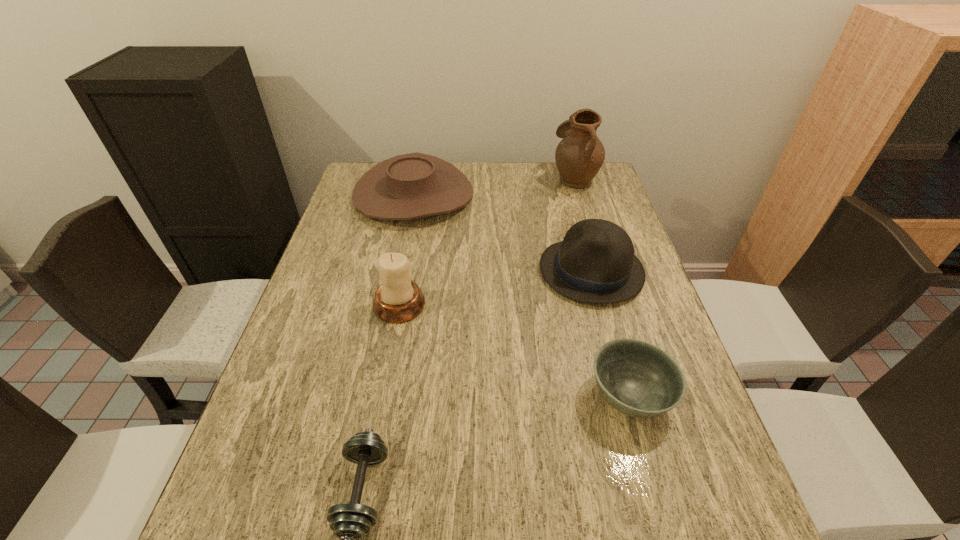
The width and height of the screenshot is (960, 540). Identify the location of object located at the far left corner. (409, 186).

You are a GUI agent. You are given a task and a screenshot of the screen. Output one action in this format:
    pyautogui.click(x=<x>, y=<y>)
    Task: Click on the object located at the far right corner
    
    Given the screenshot: What is the action you would take?
    pyautogui.click(x=579, y=156)

Where is `vacant space at the far edge of the desktop`? The height and width of the screenshot is (540, 960). vacant space at the far edge of the desktop is located at coordinates (507, 194).

The width and height of the screenshot is (960, 540). Identify the location of vacant region at the near edge. click(516, 530).

Where is `vacant space at the left edge of the desktop`? vacant space at the left edge of the desktop is located at coordinates (257, 413).

This screenshot has width=960, height=540. In the image, there is a desktop. In order to click on free space at the right edge in this screenshot , I will do `click(690, 407)`.

At what (x,y) coordinates should I click in order to perform the action: click on vacant space at the far left corner. Please return your answer as a coordinate pair (x, y). Looking at the image, I should click on (349, 195).

Where is `empty space between the bowler hat and the candle holder`? The image size is (960, 540). empty space between the bowler hat and the candle holder is located at coordinates (495, 287).

Locate an element on the screen. vacant area that lies between the fourth shortest object and the fifth farthest object is located at coordinates (611, 333).

Locate an element on the screen. The height and width of the screenshot is (540, 960). vacant area between the cowboy hat and the bowl is located at coordinates (522, 295).